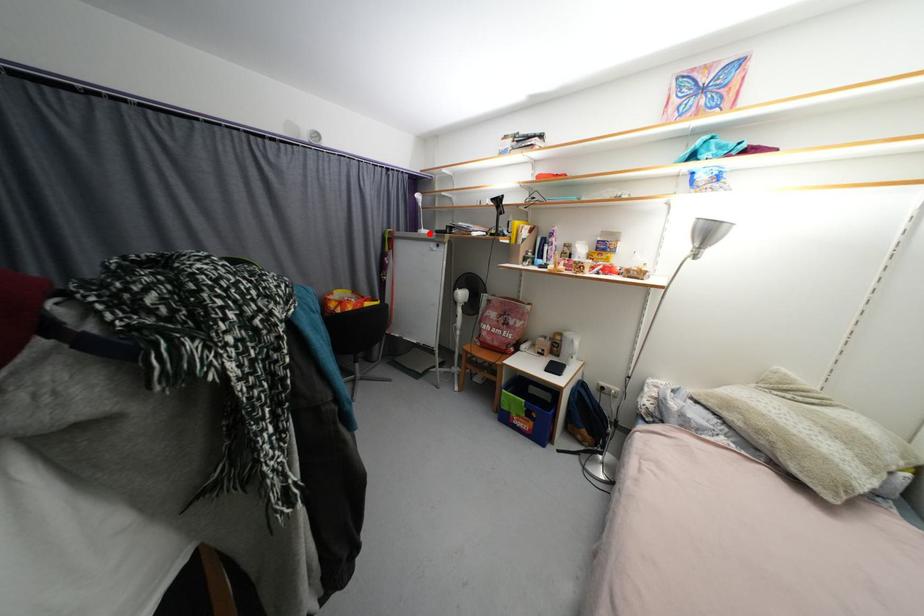
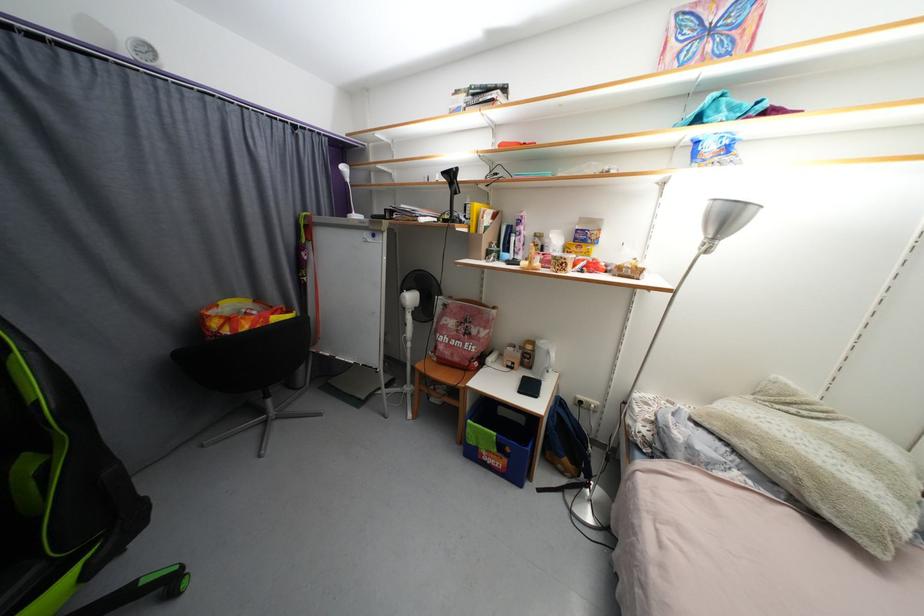
Where in the second image is the point corresponding to the highlighted location from the first image?

(360, 217)